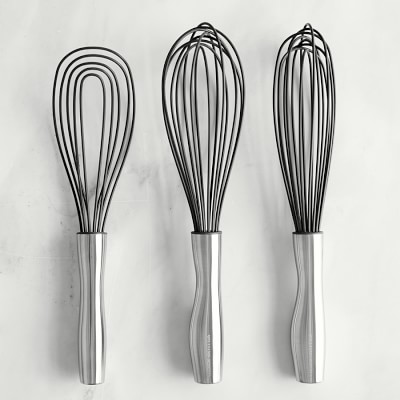
Find the location of `handle`. handle is located at coordinates (87, 270), (203, 282), (313, 267).